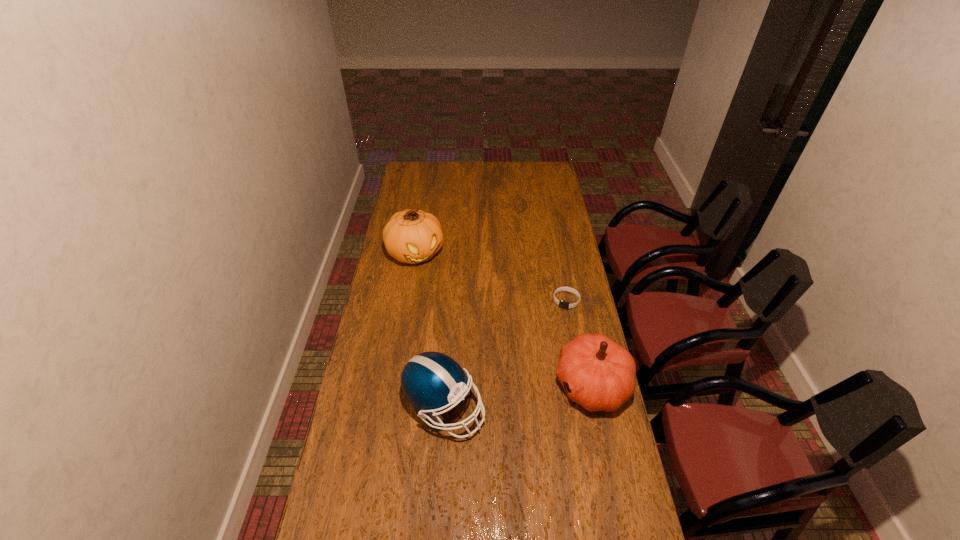
This screenshot has height=540, width=960. In order to click on blank area located 0.240m on the outer surface of the third nearest object in this screenshot , I will do `click(548, 354)`.

Image resolution: width=960 pixels, height=540 pixels. Find the location of `vacant space located 0.120m on the outer surface of the third nearest object`. vacant space located 0.120m on the outer surface of the third nearest object is located at coordinates (556, 330).

This screenshot has width=960, height=540. I want to click on vacant area located 0.230m on the outer surface of the third nearest object, so click(x=549, y=352).

Where is `free region located on the front face of the farther pumpkin`? free region located on the front face of the farther pumpkin is located at coordinates (442, 289).

You are a GUI agent. You are given a task and a screenshot of the screen. Output one action in this format:
    pyautogui.click(x=<x>, y=<y>)
    Task: Click on the vacant space positioned 0.380m on the front face of the farther pumpkin
    
    Given the screenshot: What is the action you would take?
    pyautogui.click(x=468, y=326)

Find the location of a particular element. The height and width of the screenshot is (540, 960). vacant area situated on the front face of the farther pumpkin is located at coordinates coord(441,287).

This screenshot has width=960, height=540. What are the coordinates of `object present at the left edge` in the screenshot? It's located at (412, 236).

The height and width of the screenshot is (540, 960). I want to click on pumpkin that is at the right edge, so click(x=599, y=374).

This screenshot has height=540, width=960. Find the location of `wristband located at the right edge`. wristband located at the right edge is located at coordinates (562, 304).

At what (x,y) coordinates should I click in order to perform the action: click on vacant area at the far edge. Please return your answer as a coordinate pair (x, y). The height and width of the screenshot is (540, 960). Looking at the image, I should click on (477, 179).